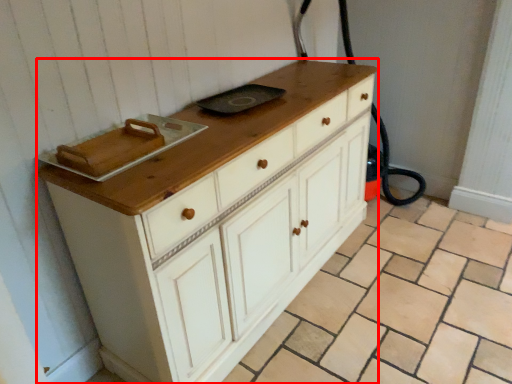
Question: From the image's perspective, what is the correct spatial positioning of chest of drawers (annotated by the red box) in reference to tile?

Choices:
 (A) below
 (B) above

Answer: (B)